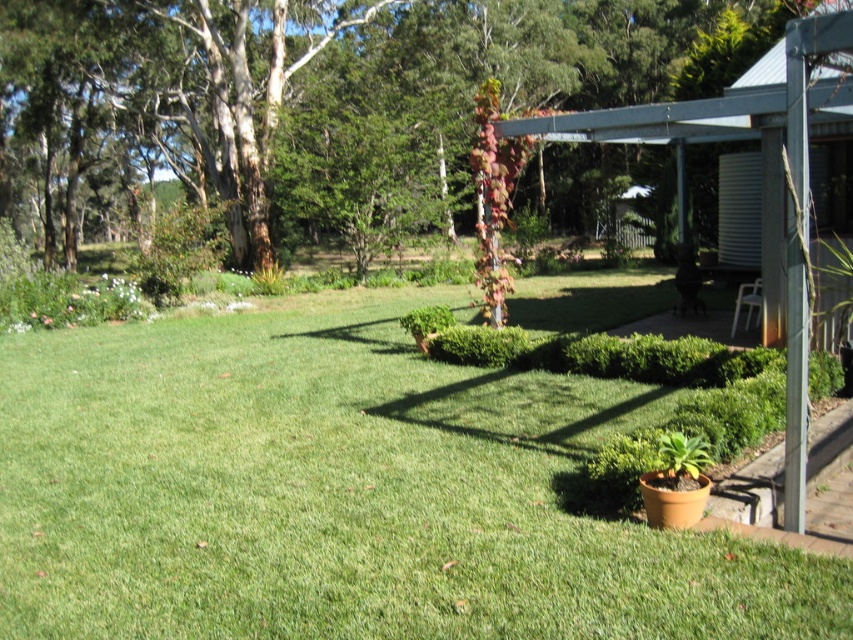
Does point (413, 554) lie behind point (96, 36)?

No, it is in front of (96, 36).

What do you see at coordinates (345, 492) in the screenshot? The height and width of the screenshot is (640, 853). I see `green grass at lower left` at bounding box center [345, 492].

Find the location of a particular element. This screenshot has width=853, height=640. green grass at lower left is located at coordinates (345, 492).

Identify the location of green grass at lower left. Image resolution: width=853 pixels, height=640 pixels. (345, 492).

At what (x,y) coordinates should I click in order to perform the action: click on brown textured tree at upper left. Please return your answer as a coordinate pair (x, y). Image resolution: width=853 pixels, height=640 pixels. Looking at the image, I should click on (318, 97).

Does point (45, 26) come in front of point (669, 138)?

No.

In order to click on brown textured tree at upper left in this screenshot , I will do `click(318, 97)`.

Which is above, green grass at lower left or metallic gray pergola at upper right?

metallic gray pergola at upper right

Can you confirm if green grass at lower left is wider than metallic gray pergola at upper right?

Indeed, green grass at lower left has a greater width compared to metallic gray pergola at upper right.

Image resolution: width=853 pixels, height=640 pixels. Find the location of `green grass at lower left`. green grass at lower left is located at coordinates (345, 492).